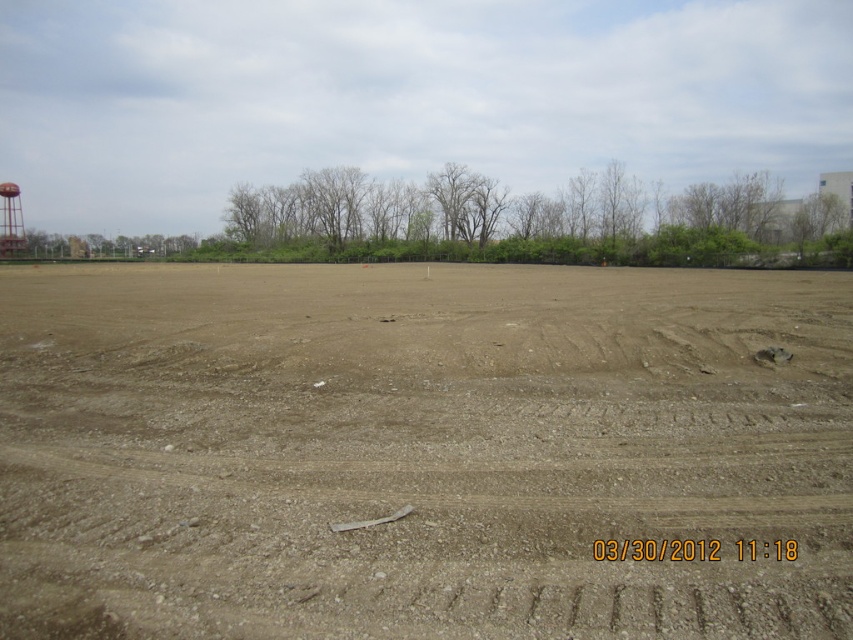
Who is positioned more to the left, brown sandy dirt at center or metallic water tower at left?

From the viewer's perspective, metallic water tower at left appears more on the left side.

How far apart are brown sandy dirt at center and metallic water tower at left?

A distance of 109.37 meters exists between brown sandy dirt at center and metallic water tower at left.

Find the location of `brown sandy dirt at center`. brown sandy dirt at center is located at coordinates (421, 451).

Can you confirm if green leafy trees at center is wider than metallic water tower at left?

Correct, the width of green leafy trees at center exceeds that of metallic water tower at left.

Which is above, green leafy trees at center or metallic water tower at left?

Positioned higher is green leafy trees at center.

Which is behind, point (601, 227) or point (3, 212)?

The point (3, 212) is behind.

At what (x,y) coordinates should I click in order to perform the action: click on green leafy trees at center. Please return your answer as a coordinate pair (x, y). The image size is (853, 640). Looking at the image, I should click on (519, 216).

Can you confirm if brown sandy dirt at center is taller than green leafy trees at center?

Incorrect, brown sandy dirt at center's height is not larger of green leafy trees at center's.

Is brown sandy dirt at center thinner than green leafy trees at center?

Indeed, brown sandy dirt at center has a lesser width compared to green leafy trees at center.

I want to click on brown sandy dirt at center, so click(x=421, y=451).

Find the location of a particular element. This screenshot has width=853, height=640. brown sandy dirt at center is located at coordinates (421, 451).